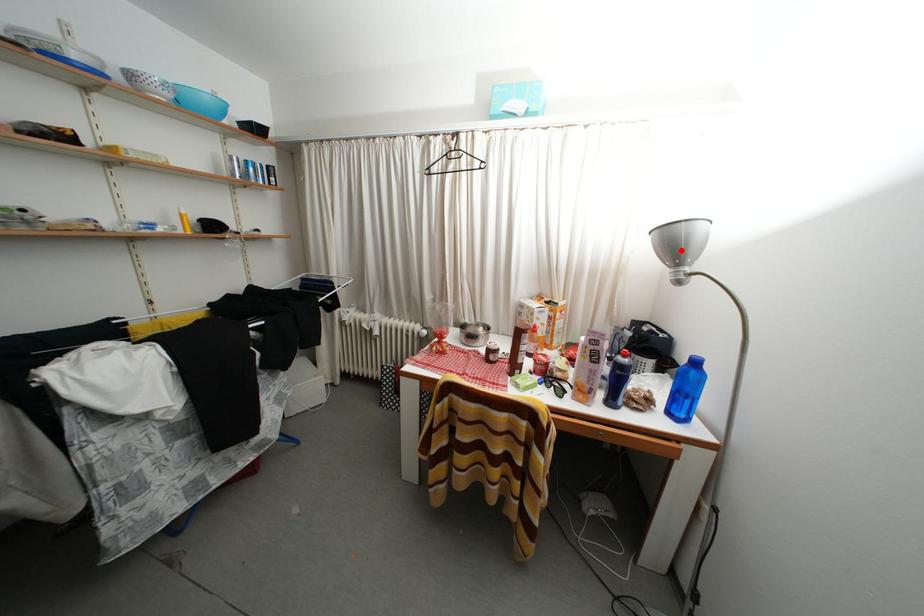
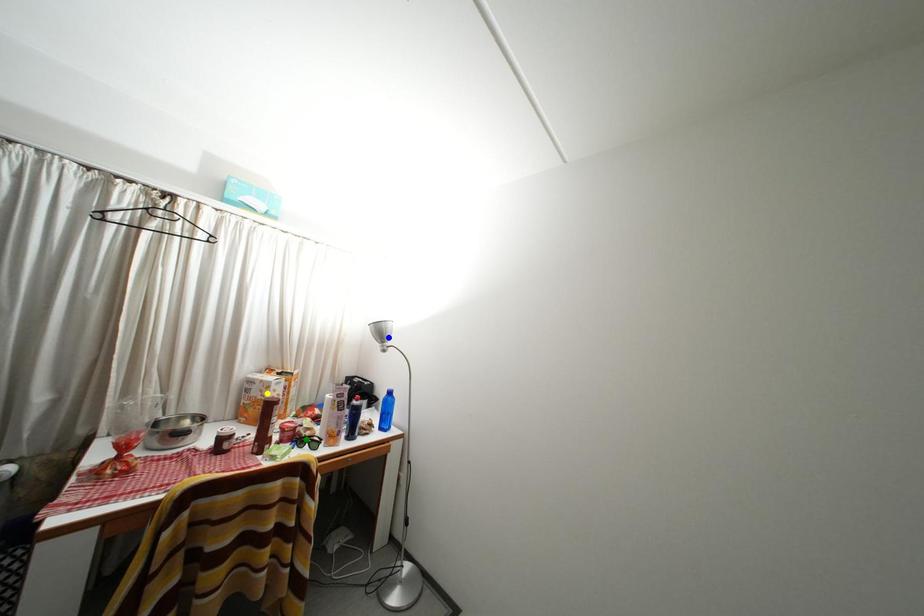
Question: I am providing you with two images of the same scene from different viewpoints. A red point is marked on the first image. You are given multiple points on the second image. Which point in image 2 is actually the same real-world point as the red point in image 1?

Choices:
 (A) blue point
 (B) green point
 (C) yellow point

Answer: (A)